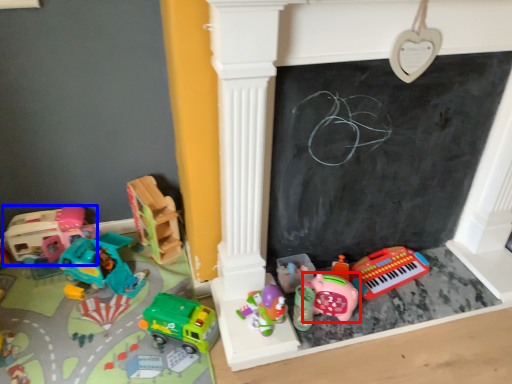
Question: Which point is further to the camera, toy (highlighted by a red box) or toy (highlighted by a blue box)?

Choices:
 (A) toy
 (B) toy

Answer: (B)